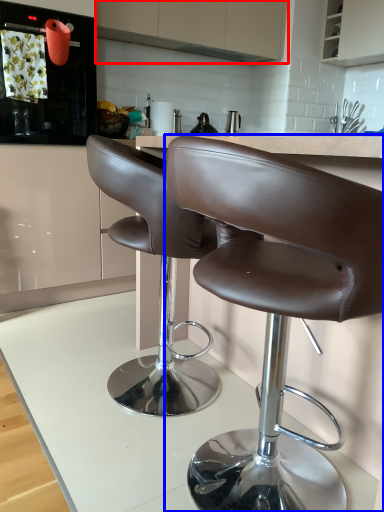
Question: Which object is closer to the camera taking this photo, cabinetry (highlighted by a red box) or chair (highlighted by a blue box)?

Choices:
 (A) cabinetry
 (B) chair

Answer: (B)